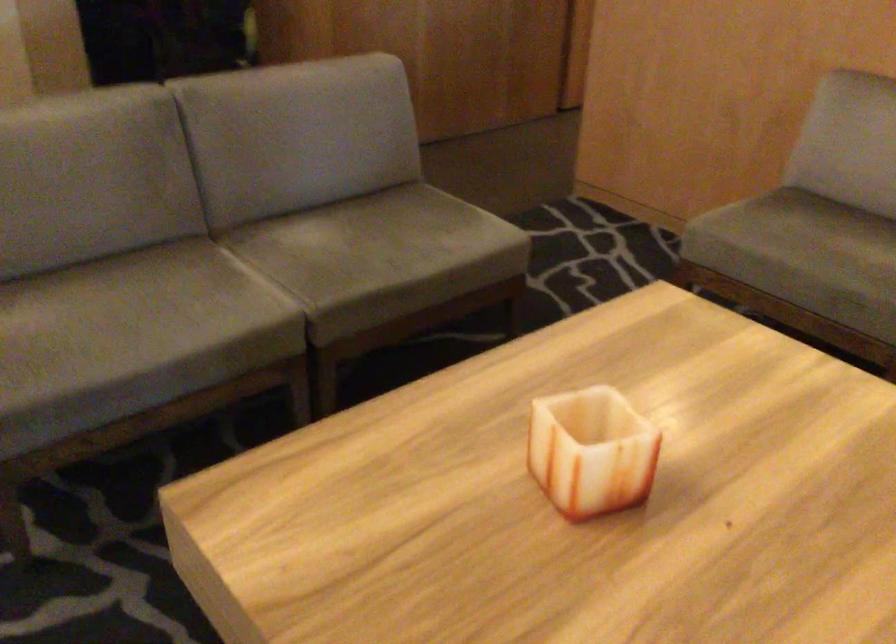
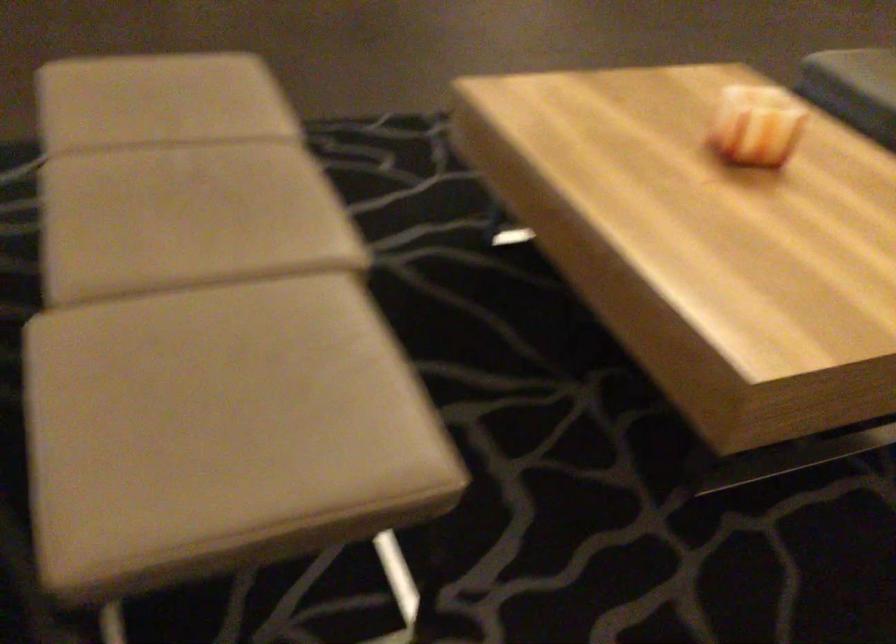
Find the pixel in the second image that matches (590,451) in the first image.

(721, 88)